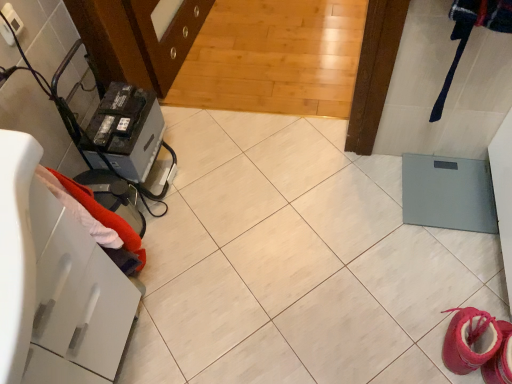
Find the location of a particular element. The height and width of the screenshot is (384, 512). vacant area on top of black plastic battery at left (from a real-world perspective) is located at coordinates (117, 109).